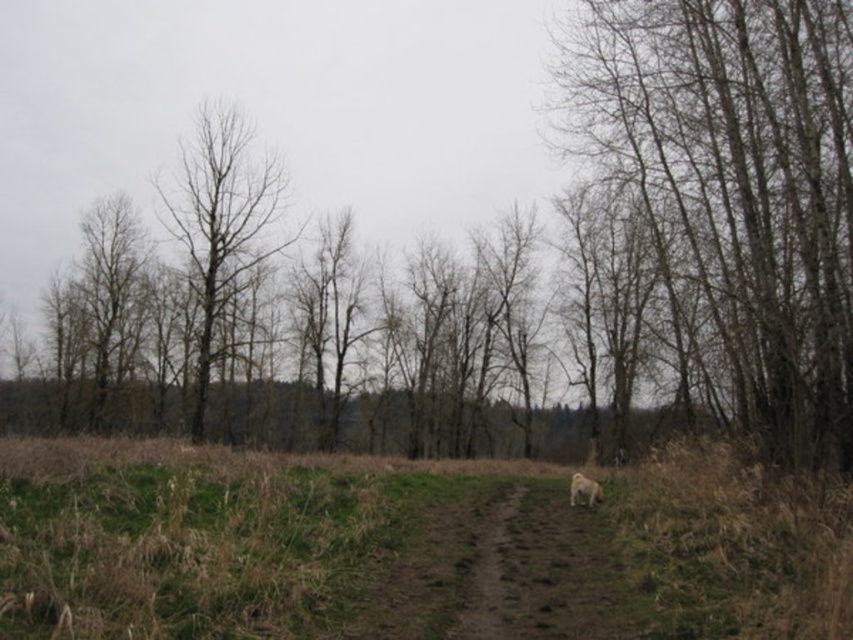
Question: Which of these objects is positioned farthest from the bare wood tree at left?

Choices:
 (A) bare wood trees at right
 (B) green grass at lower center
 (C) brown dirt trail at center

Answer: (C)

Question: Which point appears farthest from the camera in this image?

Choices:
 (A) coord(213,321)
 (B) coord(582,486)

Answer: (A)

Question: Observing the image, what is the correct spatial positioning of brown dirt trail at center in reference to fuzzy yellow dog at center-right?

Choices:
 (A) above
 (B) below

Answer: (A)

Question: Is bare wood trees at right wider than brown dirt trail at center?

Choices:
 (A) no
 (B) yes

Answer: (B)

Question: Which point is farther to the camera?

Choices:
 (A) brown dirt trail at center
 (B) bare wood trees at right
 (C) bare wood tree at left

Answer: (C)

Question: Where is green grass at lower center located in relation to bare wood trees at right in the image?

Choices:
 (A) below
 (B) above

Answer: (A)